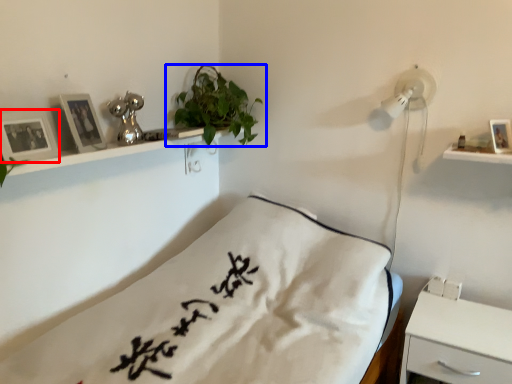
Question: Which object appears closest to the camera in this image, picture frame (highlighted by a red box) or houseplant (highlighted by a blue box)?

Choices:
 (A) picture frame
 (B) houseplant

Answer: (A)